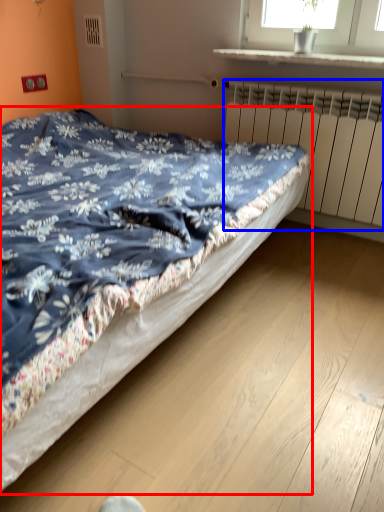
Question: Which object is closer to the camera taking this photo, bed (highlighted by a red box) or radiator (highlighted by a blue box)?

Choices:
 (A) bed
 (B) radiator

Answer: (A)